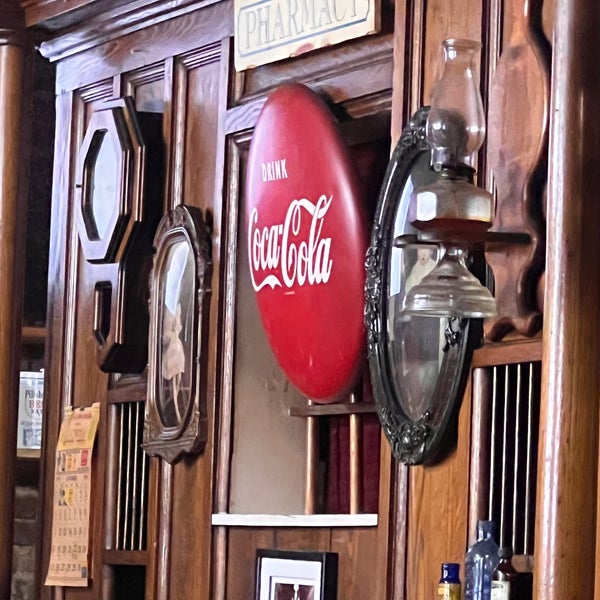
At what (x,y) coordinates should I click in order to perform the action: click on wooden pillar. Please return your answer as a coordinate pair (x, y). Image resolution: width=600 pixels, height=600 pixels. Looking at the image, I should click on (8, 315), (574, 382).